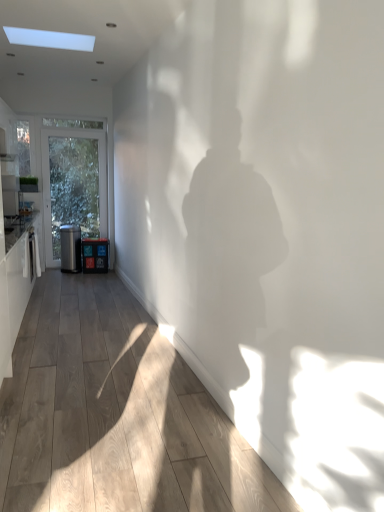
Question: Can you confirm if wooden floor at center is positioned to the left of satin black trash can at left, which is the second appliance in right-to-left order?

Choices:
 (A) yes
 (B) no

Answer: (B)

Question: Is satin black trash can at left, the first appliance viewed from the left, surrounded by wooden floor at center?

Choices:
 (A) yes
 (B) no

Answer: (B)

Question: Is wooden floor at center not close to satin black trash can at left, which is the second appliance in right-to-left order?

Choices:
 (A) no
 (B) yes

Answer: (B)

Question: Is wooden floor at center closer to the viewer compared to satin black trash can at left, which is the second appliance in right-to-left order?

Choices:
 (A) yes
 (B) no

Answer: (A)

Question: Is wooden floor at center positioned behind satin black trash can at left, which is the second appliance in right-to-left order?

Choices:
 (A) no
 (B) yes

Answer: (A)

Question: Considering the positions of matte black trash can at left, which ranks as the 1th appliance in right-to-left order, and white glossy cabinetry at left in the image, is matte black trash can at left, which ranks as the 1th appliance in right-to-left order, bigger or smaller than white glossy cabinetry at left?

Choices:
 (A) big
 (B) small

Answer: (B)

Question: From their relative heights in the image, would you say matte black trash can at left, which ranks as the 1th appliance in right-to-left order, is taller or shorter than white glossy cabinetry at left?

Choices:
 (A) tall
 (B) short

Answer: (B)

Question: Is matte black trash can at left, positioned as the 2th appliance in left-to-right order, wider or thinner than white glossy cabinetry at left?

Choices:
 (A) thin
 (B) wide

Answer: (A)

Question: Relative to white glossy cabinetry at left, is matte black trash can at left, which ranks as the 1th appliance in right-to-left order, in front or behind?

Choices:
 (A) behind
 (B) front

Answer: (A)

Question: Is white glossy cabinetry at left wider or thinner than satin black trash can at left, which is the second appliance in right-to-left order?

Choices:
 (A) thin
 (B) wide

Answer: (B)

Question: In the image, is white glossy cabinetry at left positioned in front of or behind satin black trash can at left, which is the second appliance in right-to-left order?

Choices:
 (A) front
 (B) behind

Answer: (A)

Question: Considering the positions of point (36, 240) and point (72, 260), is point (36, 240) closer or farther from the camera than point (72, 260)?

Choices:
 (A) closer
 (B) farther

Answer: (A)

Question: From a real-world perspective, relative to satin black trash can at left, the first appliance viewed from the left, is white glossy cabinetry at left vertically above or below?

Choices:
 (A) above
 (B) below

Answer: (A)

Question: Considering the positions of point (236, 441) and point (4, 266), is point (236, 441) closer or farther from the camera than point (4, 266)?

Choices:
 (A) closer
 (B) farther

Answer: (A)

Question: Would you say wooden floor at center is to the left or to the right of white glossy cabinetry at left in the picture?

Choices:
 (A) left
 (B) right

Answer: (B)